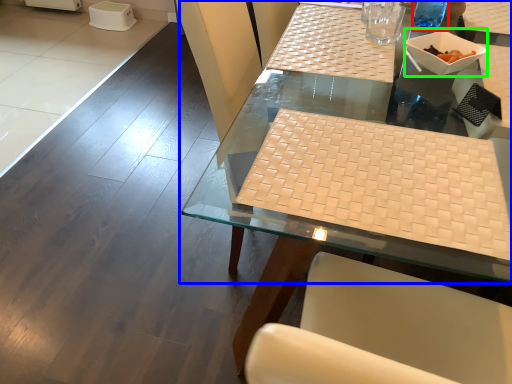
Question: Which object is positioned farthest from beverage (highlighted by a red box)? Select from table (highlighted by a blue box) and bowl (highlighted by a green box).

Choices:
 (A) table
 (B) bowl

Answer: (A)